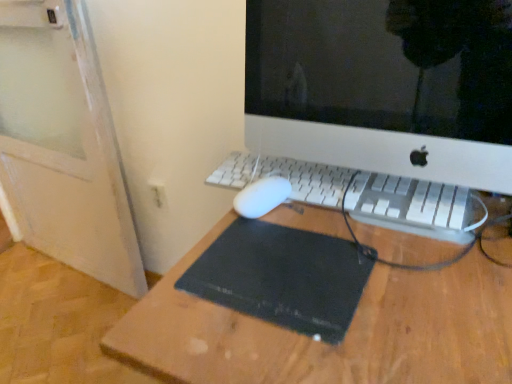
Identify the location of blank space above black rubber mousepad at center (from a real-world perspective). This screenshot has height=384, width=512. (279, 254).